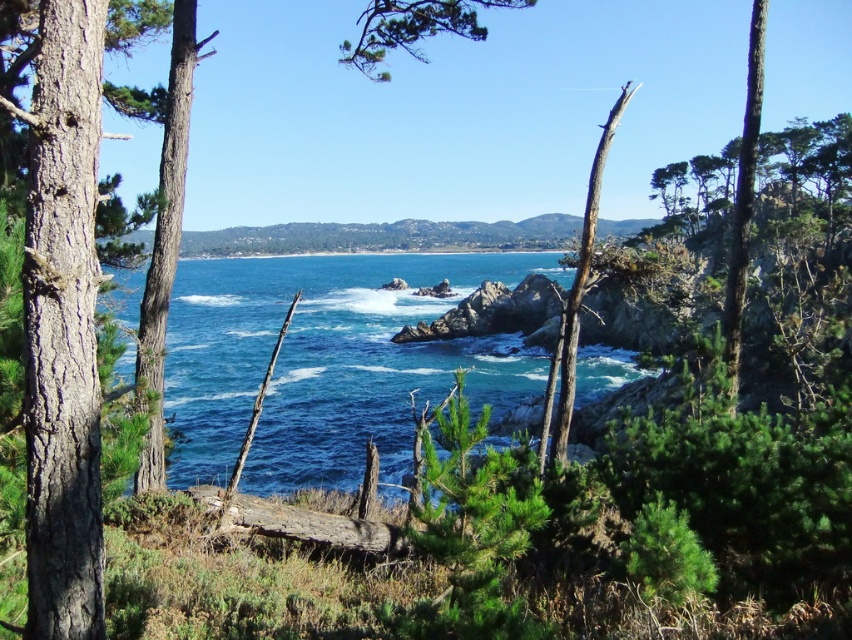
You are standing in the coastal landscape scene and want to touch the brown rough bark tree at left. Which direction should you move from the point at coordinates point (62, 326) to reach it?

The point at coordinates point (62, 326) corresponds to the brown rough bark tree at left, so you are already at the location of the brown rough bark tree at left. No movement is needed.